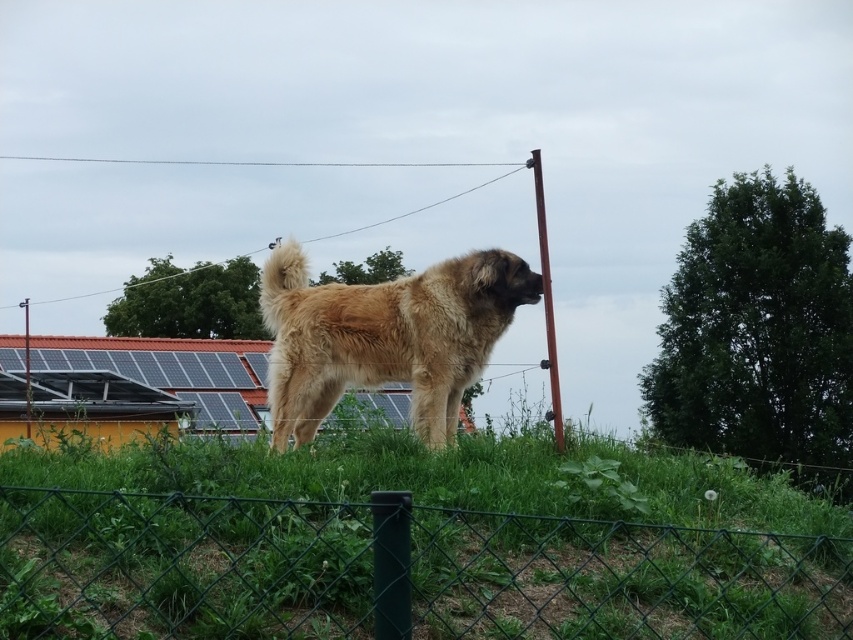
You are a photographer trying to capture a clear shot of the fuzzy golden dog at center. However, the green wire mesh fence at lower center is blocking part of your view. Based on their positions, which object should you move to the left to get a better shot?

You should move the green wire mesh fence at lower center to the left since it is currently to the right of the fuzzy golden dog at center, so shifting it left would clear the dog from obstruction.

You are a photographer positioned in front of the green wire mesh fence at lower center and want to take a picture of the fuzzy golden dog at center. Will the fence block your view of the dog?

The green wire mesh fence at lower center is closer to the viewer than the fuzzy golden dog at center, so the fence will block your view of the dog.

You are standing at the center of the image and want to approach the green wire mesh fence at lower center. Based on the coordinates provided, in which direction should you move to reach the fence?

The green wire mesh fence at lower center is located at point (396,572), which means you should move towards the lower right direction to reach it.